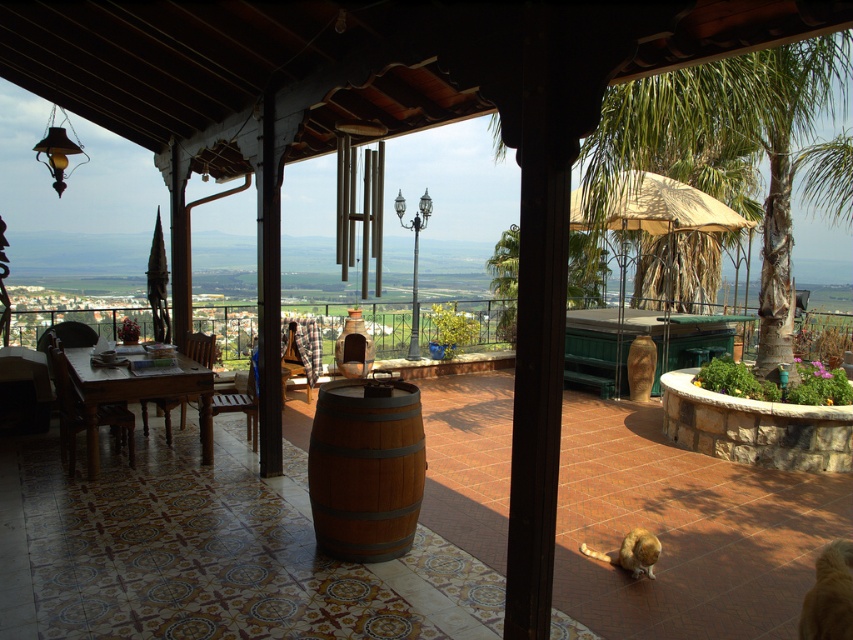
Question: Does brown wooden barrel at center have a lesser width compared to wooden table at left?

Choices:
 (A) no
 (B) yes

Answer: (B)

Question: Which object appears closest to the camera in this image?

Choices:
 (A) green leafy palm tree at upper right
 (B) brown wooden barrel at center

Answer: (B)

Question: Can you confirm if brown wooden barrel at center is thinner than wooden table at left?

Choices:
 (A) yes
 (B) no

Answer: (A)

Question: Estimate the real-world distances between objects in this image. Which object is farther from the brown wooden barrel at center?

Choices:
 (A) green leafy palm tree at upper right
 (B) wooden table at left

Answer: (A)

Question: Can you confirm if green leafy palm tree at upper right is wider than wooden table at left?

Choices:
 (A) yes
 (B) no

Answer: (B)

Question: Which point appears farthest from the camera in this image?

Choices:
 (A) (416, 468)
 (B) (119, 394)

Answer: (B)